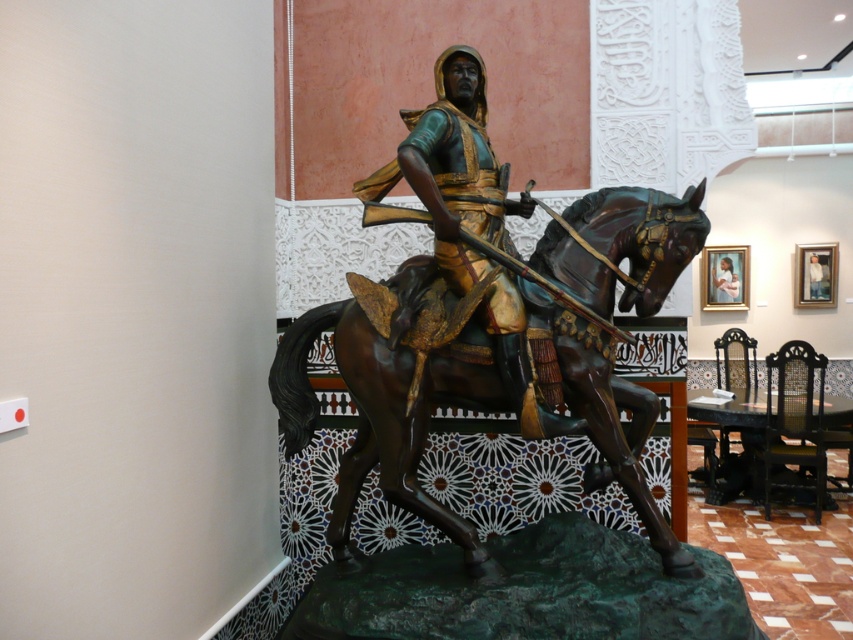
You are an art conservator assessing the bronze statue. You notice two armor sections, the green patina armor at center and the matte gold armor at center. Which armor section is taller?

The green patina armor at center is taller than the matte gold armor at center.

You are an art conservator examining the bronze statue. You notice a point of concern at coordinates point [456,168]. Based on the description, which part of the statue is this point likely located on?

The point [456,168] corresponds to the green patina armor at center, so the point of concern is likely located on the green patina armor at center.